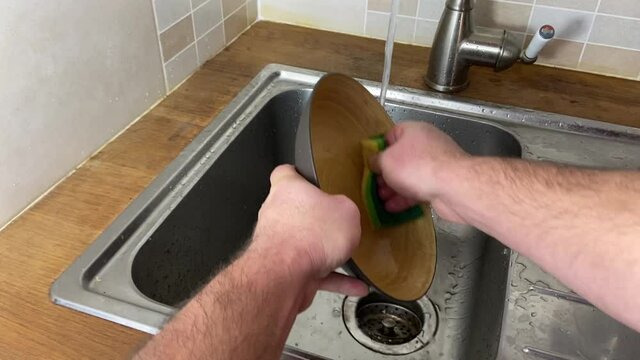
Where is `shadow of tap handle`? The image size is (640, 360). shadow of tap handle is located at coordinates (566, 33).